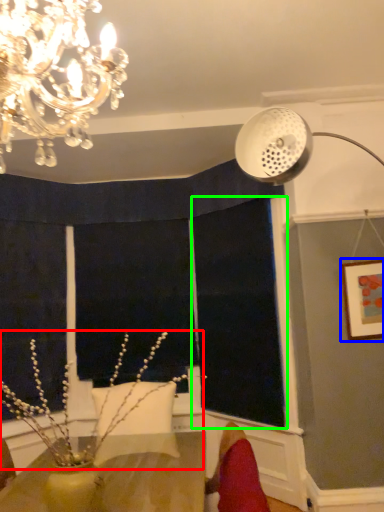
Question: Based on their relative distances, which object is farther from plant (highlighted by a red box)? Choose from picture frame (highlighted by a blue box) and window screen (highlighted by a green box).

Choices:
 (A) picture frame
 (B) window screen

Answer: (A)